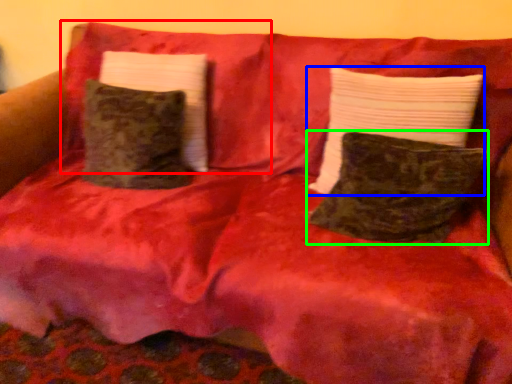
Question: Which is nearer to the pillow (highlighted by a red box)? pillow (highlighted by a blue box) or pillow (highlighted by a green box).

Choices:
 (A) pillow
 (B) pillow

Answer: (A)